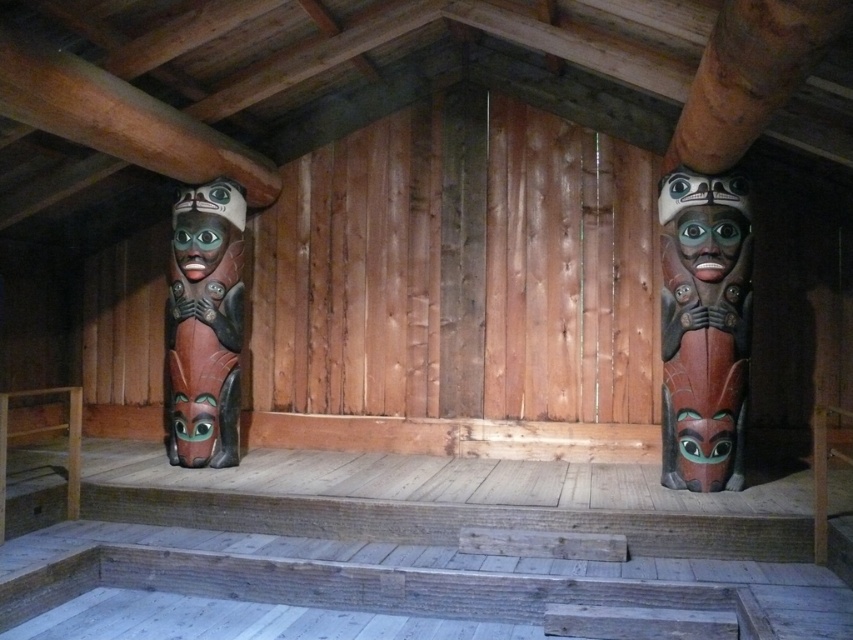
This screenshot has width=853, height=640. Identify the location of polished wood totem pole at right. 704,326.

Who is higher up, polished wood totem pole at right or polished wood totem pole at center?

Positioned higher is polished wood totem pole at center.

Find the location of `polished wood totem pole at right`. polished wood totem pole at right is located at coordinates (704, 326).

Identify the location of polished wood totem pole at right. (704, 326).